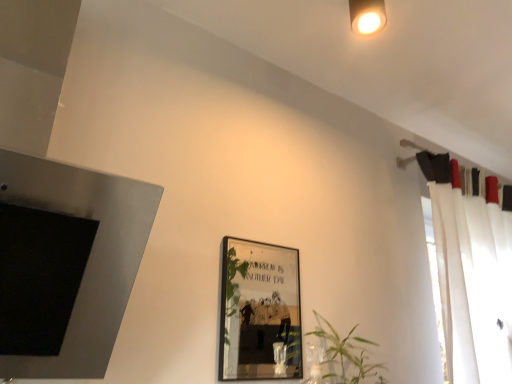
Describe the element at coordinates (90, 255) in the screenshot. I see `matte black fireplace at left` at that location.

This screenshot has width=512, height=384. Describe the element at coordinates (259, 311) in the screenshot. I see `metallic silver picture frame at center` at that location.

Where is `green leafy plant at center`? The height and width of the screenshot is (384, 512). green leafy plant at center is located at coordinates (346, 355).

What do you see at coordinates (465, 280) in the screenshot?
I see `white sheer curtain at right` at bounding box center [465, 280].

I want to click on matte black fireplace at left, so click(90, 255).

Considering the sizes of objects matte black fireplace at left and white sheer curtain at right in the image provided, who is wider, matte black fireplace at left or white sheer curtain at right?

Wider between the two is matte black fireplace at left.

The width and height of the screenshot is (512, 384). What are the coordinates of `curtain below the matte black fireplace at left (from the image's perspective)` in the screenshot? It's located at (465, 280).

Between matte black fireplace at left and white sheer curtain at right, which one has smaller size?

matte black fireplace at left is smaller.

Considering the positions of objects matte black fireplace at left and white sheer curtain at right in the image provided, who is more to the right, matte black fireplace at left or white sheer curtain at right?

From the viewer's perspective, white sheer curtain at right appears more on the right side.

Is green leafy plant at center bigger than matte black fireplace at left?

No.

Is green leafy plant at center facing away from matte black fireplace at left?

No.

From their relative heights in the image, would you say green leafy plant at center is taller or shorter than matte black fireplace at left?

Clearly, green leafy plant at center is shorter compared to matte black fireplace at left.

How much distance is there between green leafy plant at center and matte black fireplace at left?

A distance of 31.95 inches exists between green leafy plant at center and matte black fireplace at left.

Which object is further away from the camera, white sheer curtain at right or matte black fireplace at left?

white sheer curtain at right is further away from the camera.

Measure the distance from white sheer curtain at right to matte black fireplace at left.

white sheer curtain at right is 4.50 feet from matte black fireplace at left.

Find the location of `fireplace that is on the left side of white sheer curtain at right`. fireplace that is on the left side of white sheer curtain at right is located at coordinates (90, 255).

From a real-world perspective, is metallic silver picture frame at center physically located above or below green leafy plant at center?

Clearly, from a real-world perspective, metallic silver picture frame at center is above green leafy plant at center.

Identify the location of picture frame on the left of green leafy plant at center. (259, 311).

Is metallic silver picture frame at center not inside green leafy plant at center?

Yes, metallic silver picture frame at center is outside of green leafy plant at center.

From a real-world perspective, who is located lower, matte black fireplace at left or green leafy plant at center?

green leafy plant at center is physically lower.

Can you confirm if matte black fireplace at left is thinner than green leafy plant at center?

Incorrect, the width of matte black fireplace at left is not less than that of green leafy plant at center.

Does matte black fireplace at left turn towards green leafy plant at center?

No, matte black fireplace at left is not aimed at green leafy plant at center.

Which is behind, point (22, 193) or point (353, 380)?

The point (353, 380) is more distant.

Would you say white sheer curtain at right is outside green leafy plant at center?

white sheer curtain at right is positioned outside green leafy plant at center.

Consider the image. Can you confirm if white sheer curtain at right is smaller than green leafy plant at center?

Actually, white sheer curtain at right might be larger than green leafy plant at center.

Where is `curtain that appears behind the green leafy plant at center`? The height and width of the screenshot is (384, 512). curtain that appears behind the green leafy plant at center is located at coordinates (465, 280).

Looking at this image, which is in front, white sheer curtain at right or green leafy plant at center?

green leafy plant at center is closer to the camera.

This screenshot has height=384, width=512. In order to click on curtain above the metallic silver picture frame at center (from a real-world perspective) in this screenshot , I will do `click(465, 280)`.

Does point (505, 343) come in front of point (253, 303)?

No, it is not.

Which object is positioned more to the right, white sheer curtain at right or metallic silver picture frame at center?

From the viewer's perspective, white sheer curtain at right appears more on the right side.

Considering the relative sizes of white sheer curtain at right and metallic silver picture frame at center in the image provided, is white sheer curtain at right shorter than metallic silver picture frame at center?

In fact, white sheer curtain at right may be taller than metallic silver picture frame at center.

Locate an element on the screen. The height and width of the screenshot is (384, 512). curtain that appears below the matte black fireplace at left (from a real-world perspective) is located at coordinates (465, 280).

In the image, there is a green leafy plant at center. At what (x,y) coordinates should I click in order to perform the action: click on fireplace above it (from the image's perspective). Please return your answer as a coordinate pair (x, y). Image resolution: width=512 pixels, height=384 pixels. Looking at the image, I should click on (90, 255).

Consider the image. Which object lies further to the anchor point matte black fireplace at left, metallic silver picture frame at center or green leafy plant at center?

The object further to matte black fireplace at left is metallic silver picture frame at center.

Estimate the real-world distances between objects in this image. Which object is closer to green leafy plant at center, metallic silver picture frame at center or matte black fireplace at left?

matte black fireplace at left lies closer to green leafy plant at center than the other object.

When comparing their distances from green leafy plant at center, does metallic silver picture frame at center or white sheer curtain at right seem further?

metallic silver picture frame at center is positioned further to the anchor green leafy plant at center.

Estimate the real-world distances between objects in this image. Which object is further from metallic silver picture frame at center, green leafy plant at center or matte black fireplace at left?

matte black fireplace at left.

Which object lies nearer to the anchor point metallic silver picture frame at center, green leafy plant at center or white sheer curtain at right?

white sheer curtain at right lies closer to metallic silver picture frame at center than the other object.

Estimate the real-world distances between objects in this image. Which object is closer to white sheer curtain at right, matte black fireplace at left or green leafy plant at center?

green leafy plant at center lies closer to white sheer curtain at right than the other object.

In the scene shown: When comparing their distances from metallic silver picture frame at center, does matte black fireplace at left or white sheer curtain at right seem closer?

white sheer curtain at right is closer to metallic silver picture frame at center.

Considering their positions, is white sheer curtain at right positioned closer to green leafy plant at center than matte black fireplace at left?

white sheer curtain at right is closer to green leafy plant at center.

Where is `houseplant between metallic silver picture frame at center and white sheer curtain at right in the horizontal direction`? The width and height of the screenshot is (512, 384). houseplant between metallic silver picture frame at center and white sheer curtain at right in the horizontal direction is located at coordinates (346, 355).

Locate an element on the screen. This screenshot has width=512, height=384. picture frame between matte black fireplace at left and green leafy plant at center in the front-back direction is located at coordinates (259, 311).

The height and width of the screenshot is (384, 512). I want to click on houseplant located between matte black fireplace at left and white sheer curtain at right in the left-right direction, so point(346,355).

The image size is (512, 384). In order to click on picture frame situated between matte black fireplace at left and white sheer curtain at right from left to right in this screenshot , I will do `click(259, 311)`.